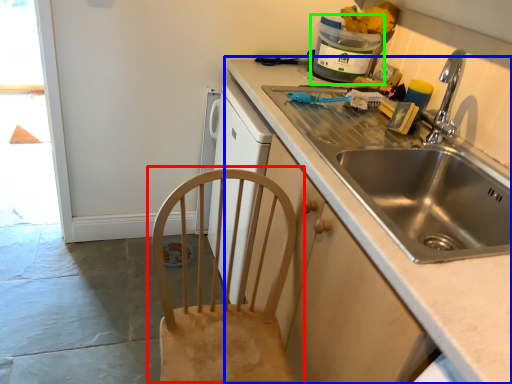
Question: Estimate the real-world distances between objects in this image. Which object is closer to chair (highlighted by a red box), countertop (highlighted by a blue box) or appliance (highlighted by a green box)?

Choices:
 (A) countertop
 (B) appliance

Answer: (A)